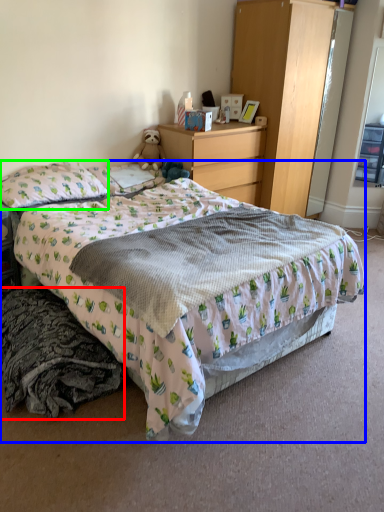
Question: Considering the real-world distances, which object is closest to material (highlighted by a red box)? bed (highlighted by a blue box) or pillow (highlighted by a green box).

Choices:
 (A) bed
 (B) pillow

Answer: (A)